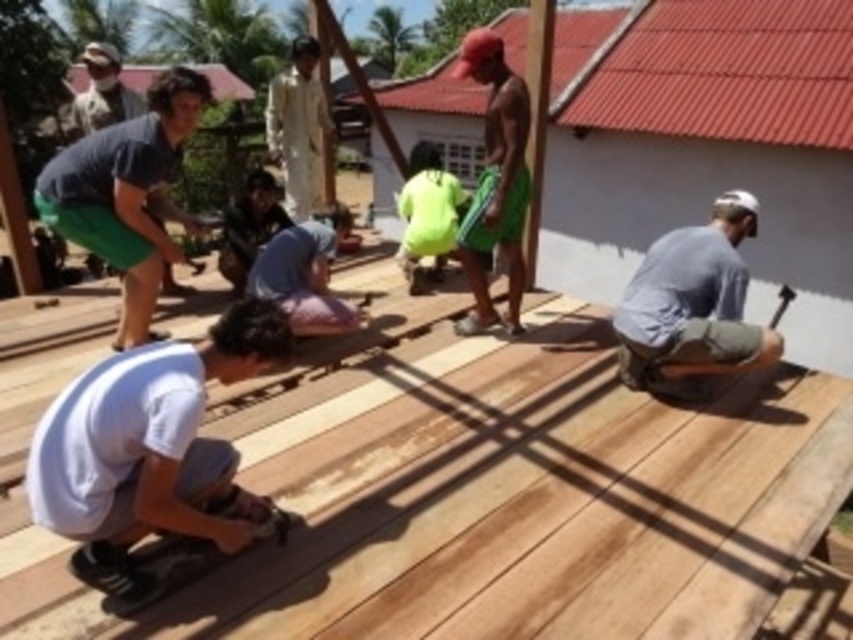
Question: Which point is closer to the camera?

Choices:
 (A) gray fabric shirt at lower right
 (B) green fabric shorts at center
 (C) camouflage fabric hat at upper left

Answer: (A)

Question: Which point is closer to the camera taking this photo?

Choices:
 (A) tap(222, 602)
 (B) tap(318, 136)
 (C) tap(663, 241)

Answer: (A)

Question: Which point is closer to the camera?

Choices:
 (A) (126, 108)
 (B) (525, 230)

Answer: (A)

Question: Does green fabric shorts at center come behind camouflage fabric hat at upper left?

Choices:
 (A) yes
 (B) no

Answer: (B)

Question: Is the position of light brown wood at center more distant than that of matte blue shirt at upper left?

Choices:
 (A) no
 (B) yes

Answer: (A)

Question: Is light brown wood at center in front of green fabric shorts at center?

Choices:
 (A) no
 (B) yes

Answer: (B)